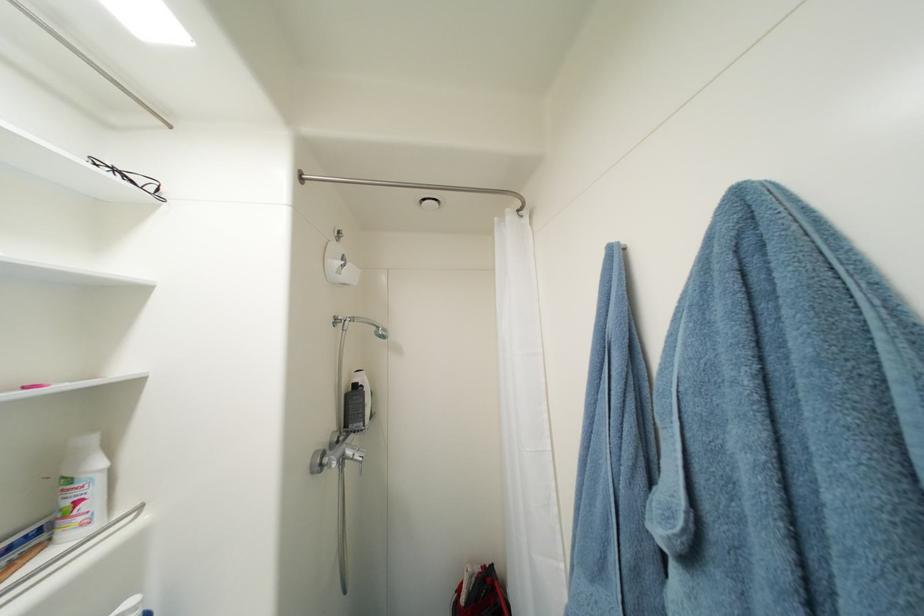
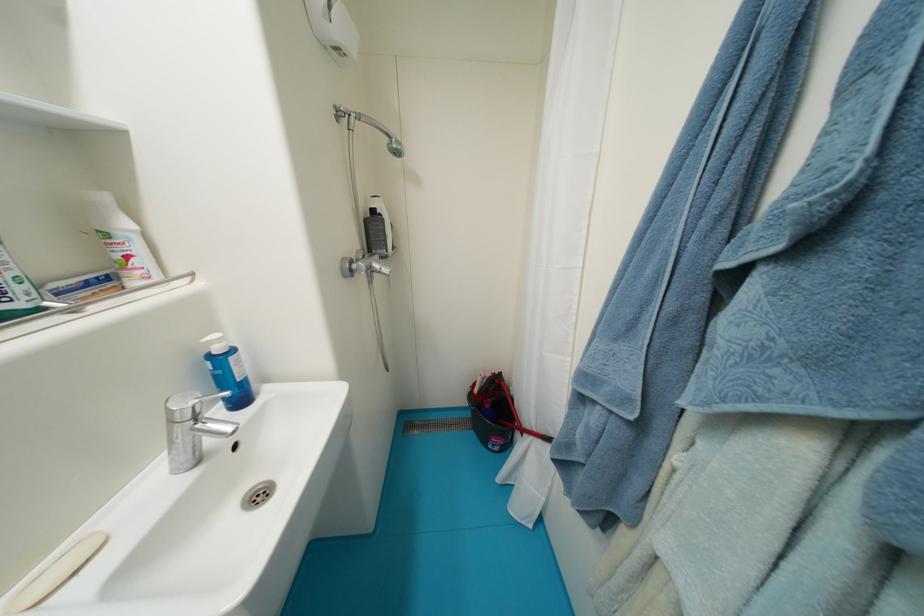
In the second image, find the point that corresponds to point 361,387 in the first image.

(380, 214)